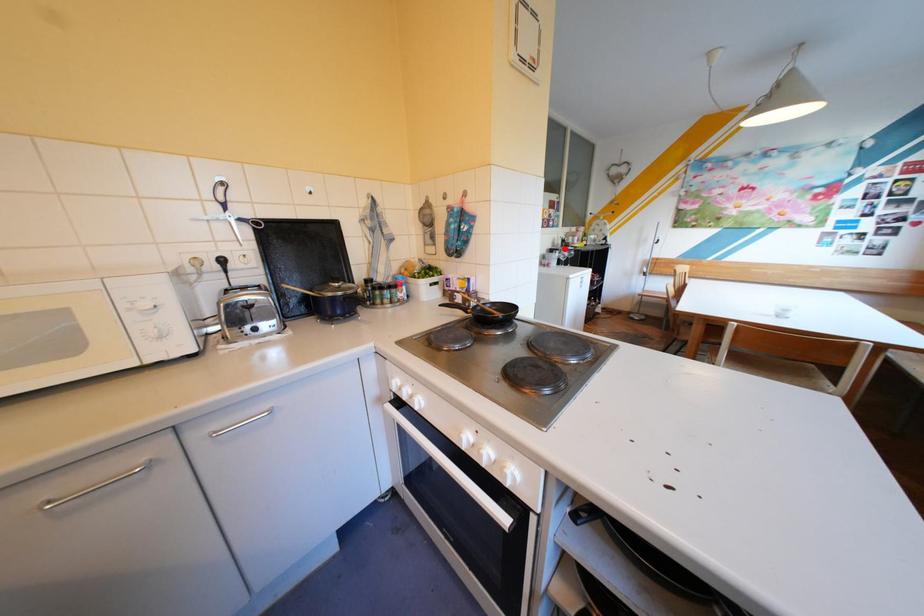
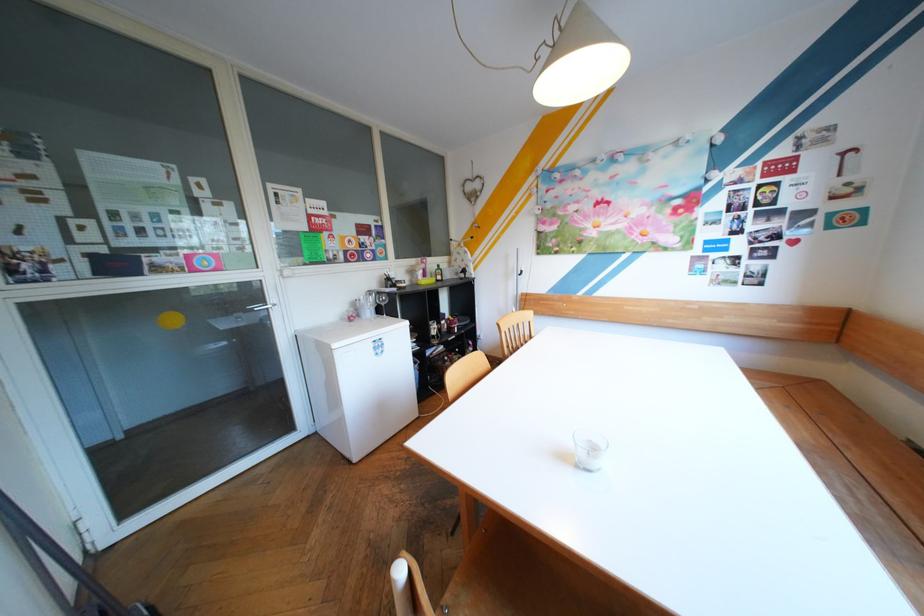
Find the pixel in the second image that matches the highlighted location in the first image.

(383, 292)